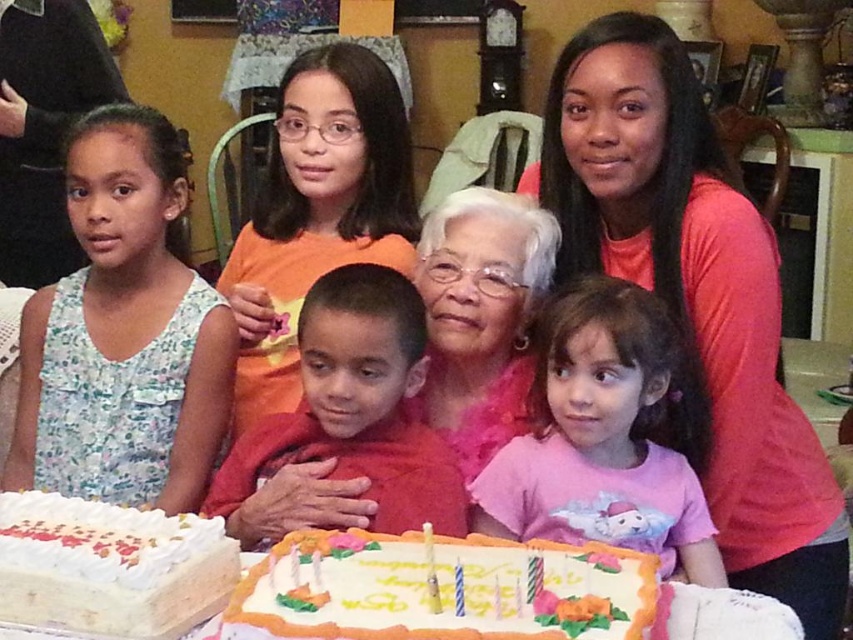
Which of these two, white frosted cake with colorful decorations at lower center or white frosted cake at lower left, stands taller?

white frosted cake at lower left

Based on the photo, does white frosted cake with colorful decorations at lower center lie behind white frosted cake at lower left?

That is False.

The image size is (853, 640). Describe the element at coordinates (440, 588) in the screenshot. I see `white frosted cake with colorful decorations at lower center` at that location.

The height and width of the screenshot is (640, 853). Find the location of `white frosted cake with colorful decorations at lower center`. white frosted cake with colorful decorations at lower center is located at coordinates (440, 588).

Who is shorter, pink satin blouse at center or white frosted cake with colorful decorations at lower center?

white frosted cake with colorful decorations at lower center

Can you confirm if pink satin blouse at center is smaller than white frosted cake with colorful decorations at lower center?

No, pink satin blouse at center is not smaller than white frosted cake with colorful decorations at lower center.

Who is more distant from viewer, (521, 180) or (480, 572)?

Positioned behind is point (521, 180).

At what (x,y) coordinates should I click in order to perform the action: click on pink satin blouse at center. Please return your answer as a coordinate pair (x, y). Looking at the image, I should click on (694, 300).

Is pink cotton shirt at lower center positioned behind white frosted cake at lower left?

Yes, pink cotton shirt at lower center is behind white frosted cake at lower left.

Find the location of a particular element. This screenshot has width=853, height=640. pink cotton shirt at lower center is located at coordinates (602, 438).

Is point (535, 499) less distant than point (45, 563)?

No, (535, 499) is behind (45, 563).

Find the location of a particular element. Image resolution: width=853 pixels, height=640 pixels. pink cotton shirt at lower center is located at coordinates (x=602, y=438).